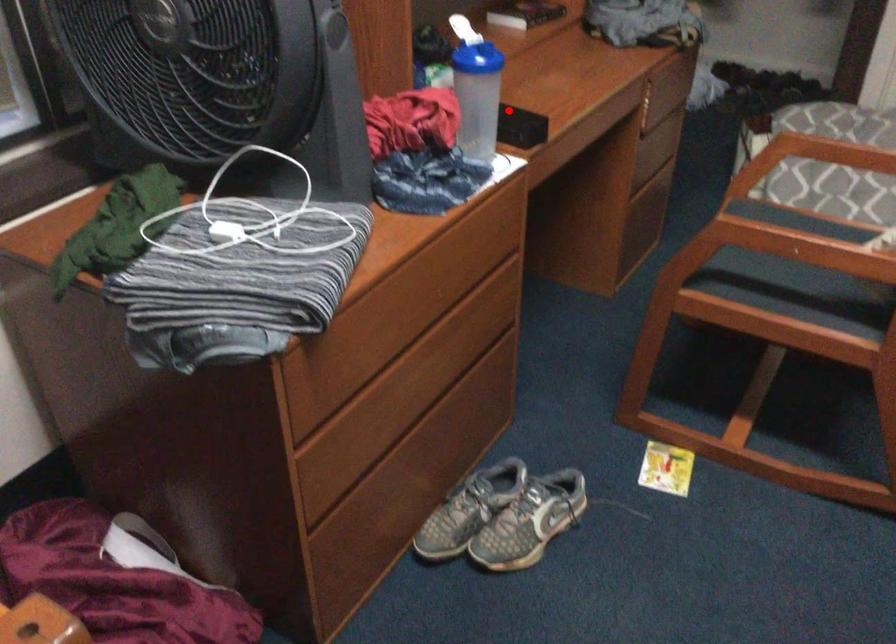
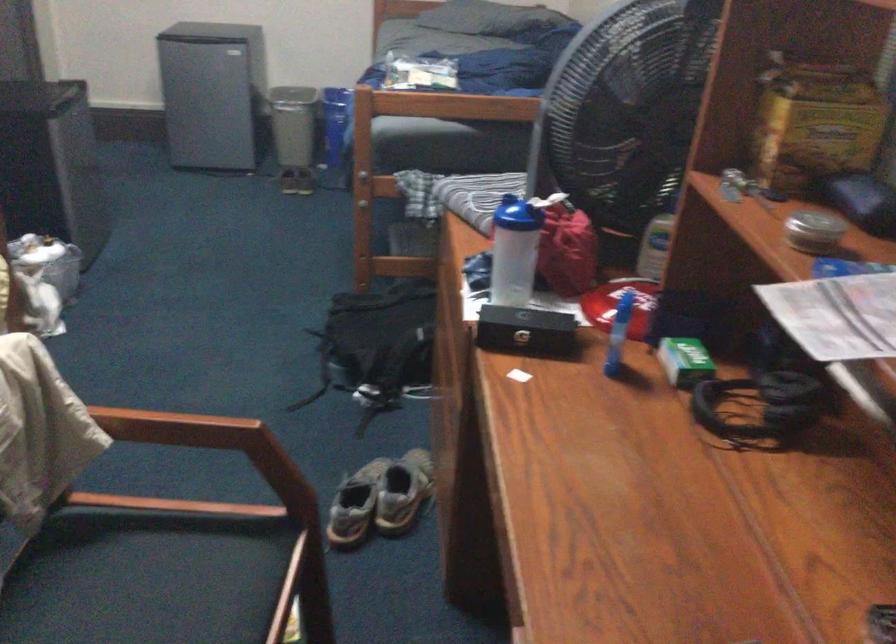
Question: I am providing you with two images of the same scene from different viewpoints. Image1 has a red point marked. In image2, the corresponding 3D location appears at what relative position? Reply with the corresponding letter.

Choices:
 (A) Closer
 (B) Farther

Answer: (A)